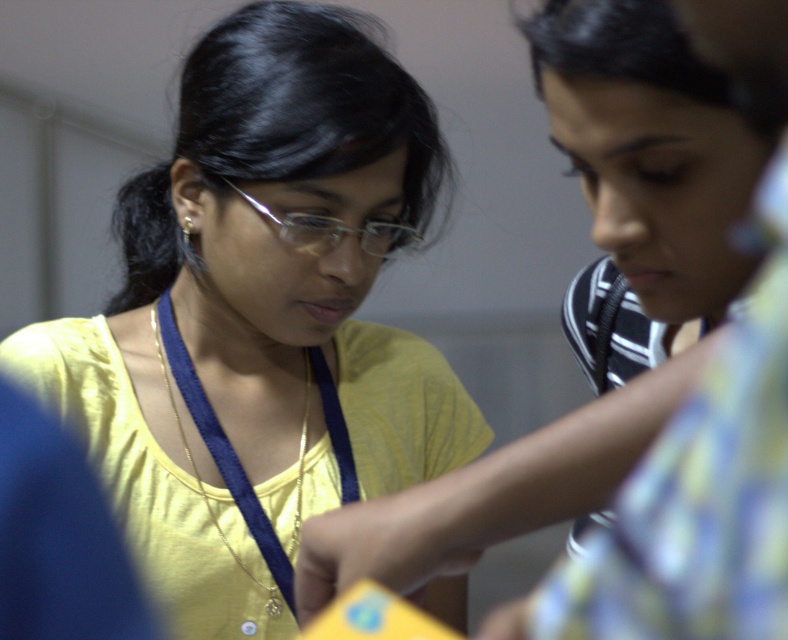
You are standing in front of a group photo where two people are collaborating. There is a point at coordinates (259, 317). Based on the scene description, can you determine which object this point is located on?

The point at coordinates (259, 317) is located on the yellow matte shirt at center.

Based on the photo, you are standing in a room and see the yellow fabric shirt at upper left and the blue fabric at center. Which object is positioned more to the right side?

The yellow fabric shirt at upper left is positioned more to the right side than the blue fabric at center.